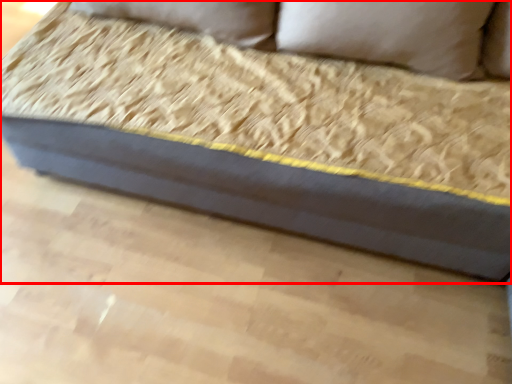
Question: From the image's perspective, what is the correct spatial relationship of studio couch (annotated by the red box) in relation to pillow?

Choices:
 (A) above
 (B) below

Answer: (B)